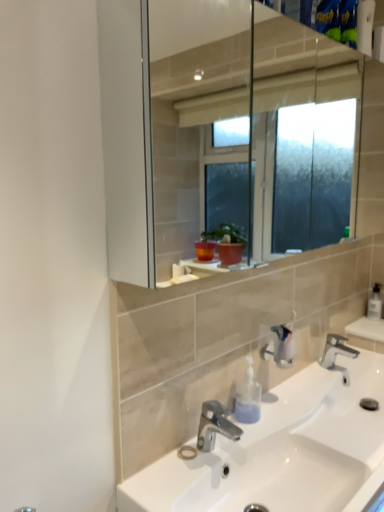
The height and width of the screenshot is (512, 384). Find the location of `vacant space to the left of polished chrome faucet at center, which appears as the 1th tap when viewed from the front`. vacant space to the left of polished chrome faucet at center, which appears as the 1th tap when viewed from the front is located at coordinates (157, 477).